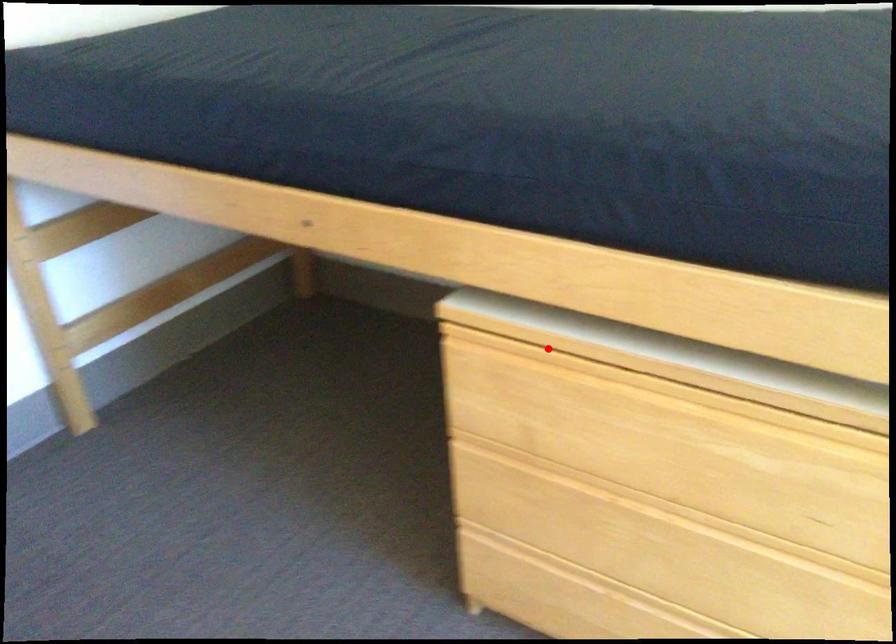
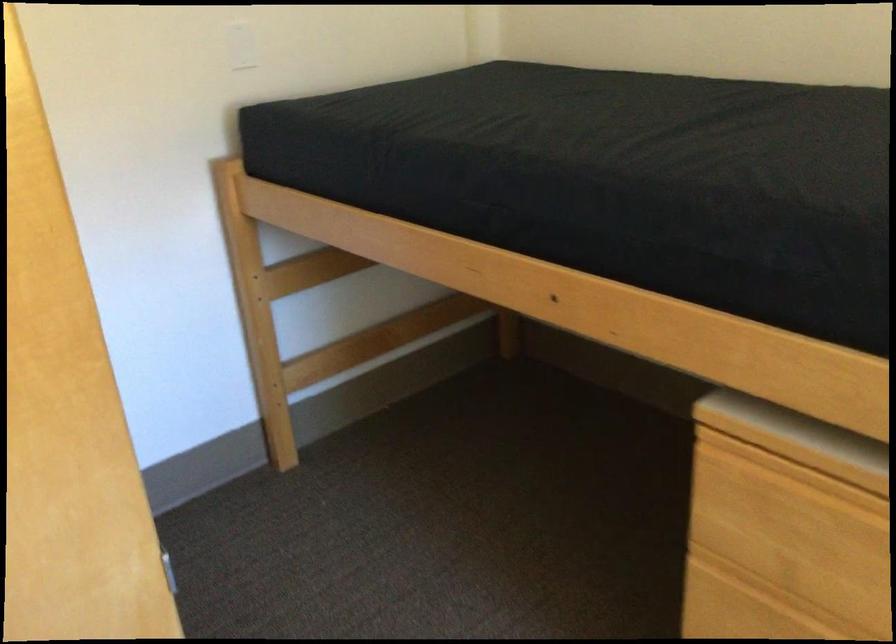
Question: A red point is marked in image1. In image2, is the corresponding 3D point closer to the camera or farther? Reply with the corresponding letter.

Choices:
 (A) The corresponding 3D point is closer.
 (B) The corresponding 3D point is farther.

Answer: (A)